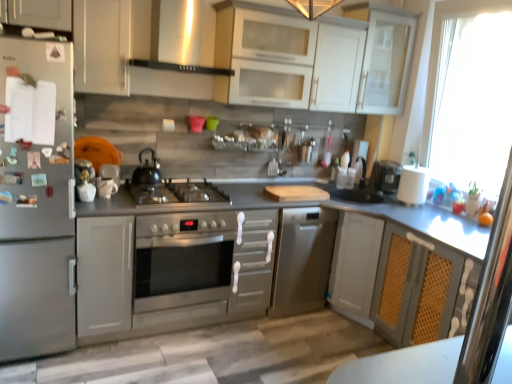
Locate an element on the screen. The width and height of the screenshot is (512, 384). empty space that is ontop of satin gray cabinet at center, which ranks as the first cabinetry in left-to-right order is located at coordinates (105, 203).